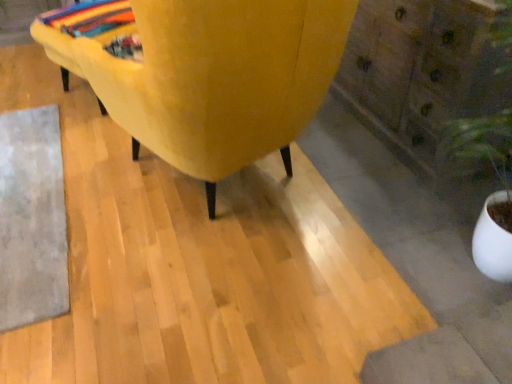
Question: Is velvet yellow chair at center further to the viewer compared to multicolored woven blanket at upper left?

Choices:
 (A) yes
 (B) no

Answer: (B)

Question: Does velvet yellow chair at center have a greater width compared to multicolored woven blanket at upper left?

Choices:
 (A) yes
 (B) no

Answer: (A)

Question: From the image's perspective, is velvet yellow chair at center beneath multicolored woven blanket at upper left?

Choices:
 (A) yes
 (B) no

Answer: (A)

Question: Is multicolored woven blanket at upper left surrounded by velvet yellow chair at center?

Choices:
 (A) no
 (B) yes

Answer: (A)

Question: From a real-world perspective, is velvet yellow chair at center on multicolored woven blanket at upper left?

Choices:
 (A) no
 (B) yes

Answer: (B)

Question: Does point (111, 24) appear closer or farther from the camera than point (19, 233)?

Choices:
 (A) farther
 (B) closer

Answer: (A)

Question: In terms of size, does multicolored woven blanket at upper left appear bigger or smaller than gray woolen mat at lower left?

Choices:
 (A) big
 (B) small

Answer: (B)

Question: Is multicolored woven blanket at upper left inside the boundaries of gray woolen mat at lower left, or outside?

Choices:
 (A) inside
 (B) outside

Answer: (B)

Question: From a real-world perspective, is multicolored woven blanket at upper left positioned above or below gray woolen mat at lower left?

Choices:
 (A) above
 (B) below

Answer: (A)

Question: Is point (69, 11) positioned closer to the camera than point (393, 102)?

Choices:
 (A) closer
 (B) farther

Answer: (B)

Question: Based on their positions, is multicolored woven blanket at upper left located to the left or right of wooden dresser at lower right?

Choices:
 (A) left
 (B) right

Answer: (A)

Question: In terms of height, does multicolored woven blanket at upper left look taller or shorter compared to wooden dresser at lower right?

Choices:
 (A) tall
 (B) short

Answer: (B)

Question: Do you think multicolored woven blanket at upper left is within wooden dresser at lower right, or outside of it?

Choices:
 (A) outside
 (B) inside

Answer: (A)

Question: Relative to velvet yellow chair at center, is wooden dresser at lower right in front or behind?

Choices:
 (A) front
 (B) behind

Answer: (B)

Question: Is point (489, 69) positioned closer to the camera than point (259, 6)?

Choices:
 (A) farther
 (B) closer

Answer: (A)